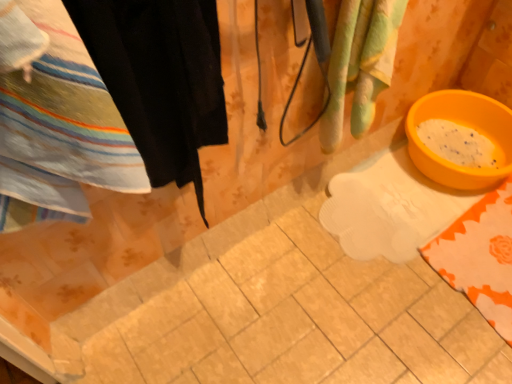
Looking at this image, what is the approximate width of green striped towel at upper right?

11.17 centimeters.

In the scene shown: What is the approximate width of striped cotton towel at left?

7.85 inches.

The image size is (512, 384). In order to click on green striped towel at upper right in this screenshot , I will do `click(360, 65)`.

In the scene shown: Is orange plastic basin at lower right not inside black fabric at left?

Absolutely, orange plastic basin at lower right is external to black fabric at left.

Considering the sizes of objects orange plastic basin at lower right and black fabric at left in the image provided, who is taller, orange plastic basin at lower right or black fabric at left?

Standing taller between the two is black fabric at left.

Considering the sizes of objects orange plastic basin at lower right and black fabric at left in the image provided, who is wider, orange plastic basin at lower right or black fabric at left?

With larger width is orange plastic basin at lower right.

The height and width of the screenshot is (384, 512). Find the location of `clothing located on the left of orange plastic basin at lower right`. clothing located on the left of orange plastic basin at lower right is located at coordinates (160, 78).

Considering the relative sizes of green striped towel at upper right and striped cotton towel at left in the image provided, is green striped towel at upper right bigger than striped cotton towel at left?

Incorrect, green striped towel at upper right is not larger than striped cotton towel at left.

Is green striped towel at upper right taller or shorter than striped cotton towel at left?

Considering their sizes, green striped towel at upper right has more height than striped cotton towel at left.

Does green striped towel at upper right come in front of striped cotton towel at left?

No, it is behind striped cotton towel at left.

From a real-world perspective, is green striped towel at upper right positioned over striped cotton towel at left based on gravity?

No, from a real-world perspective, green striped towel at upper right is not above striped cotton towel at left.

Relative to green striped towel at upper right, is black fabric at left in front or behind?

black fabric at left is in front of green striped towel at upper right.

From the image's perspective, would you say black fabric at left is shown under green striped towel at upper right?

Correct, black fabric at left appears lower than green striped towel at upper right in the image.

Does black fabric at left have a greater height compared to green striped towel at upper right?

Yes, black fabric at left is taller than green striped towel at upper right.

At what (x,y) coordinates should I click in order to perform the action: click on clothing above the orange plastic basin at lower right (from a real-world perspective). Please return your answer as a coordinate pair (x, y). Image resolution: width=512 pixels, height=384 pixels. Looking at the image, I should click on (160, 78).

Is black fabric at left not inside orange plastic basin at lower right?

black fabric at left is positioned outside orange plastic basin at lower right.

Between point (164, 83) and point (419, 166), which one is positioned in front?

The point (164, 83) is in front.

Considering the sizes of black fabric at left and orange plastic basin at lower right in the image, is black fabric at left wider or thinner than orange plastic basin at lower right?

Considering their sizes, black fabric at left looks slimmer than orange plastic basin at lower right.

From the image's perspective, between striped cotton towel at left and orange plastic basin at lower right, which one is located above?

From the image's view, orange plastic basin at lower right is above.

From a real-world perspective, who is located lower, striped cotton towel at left or orange plastic basin at lower right?

In real-world perspective, orange plastic basin at lower right is lower.

Which of these two, striped cotton towel at left or orange plastic basin at lower right, is thinner?

striped cotton towel at left.

Would you consider striped cotton towel at left to be distant from orange plastic basin at lower right?

striped cotton towel at left is far away from orange plastic basin at lower right.

Considering the relative positions of black fabric at left and striped cotton towel at left in the image provided, is black fabric at left to the left or to the right of striped cotton towel at left?

In the image, black fabric at left appears on the right side of striped cotton towel at left.

Considering their positions, is black fabric at left located in front of or behind striped cotton towel at left?

black fabric at left is positioned farther from the viewer than striped cotton towel at left.

Is black fabric at left facing towards striped cotton towel at left?

No, black fabric at left is not turned towards striped cotton towel at left.

From the image's perspective, between black fabric at left and striped cotton towel at left, who is located below?

striped cotton towel at left appears lower in the image.

Is green striped towel at upper right facing towards orange plastic basin at lower right?

No, green striped towel at upper right is not aimed at orange plastic basin at lower right.

Is green striped towel at upper right taller than orange plastic basin at lower right?

Correct, green striped towel at upper right is much taller as orange plastic basin at lower right.

Which object is further away from the camera, green striped towel at upper right or orange plastic basin at lower right?

orange plastic basin at lower right is further away from the camera.

Consider the image. Is green striped towel at upper right in contact with orange plastic basin at lower right?

No, green striped towel at upper right is not next to orange plastic basin at lower right.

Find the location of `clothing above the orange plastic basin at lower right (from a real-world perspective)`. clothing above the orange plastic basin at lower right (from a real-world perspective) is located at coordinates (160, 78).

Identify the location of beach towel that is behind the striped cotton towel at left. pos(360,65).

Based on their spatial positions, is orange plastic basin at lower right or striped cotton towel at left closer to black fabric at left?

Among the two, striped cotton towel at left is located nearer to black fabric at left.

Which object lies further to the anchor point black fabric at left, orange plastic basin at lower right or green striped towel at upper right?

Among the two, orange plastic basin at lower right is located further to black fabric at left.

Considering their positions, is orange plastic basin at lower right positioned closer to striped cotton towel at left than black fabric at left?

black fabric at left.

Consider the image. Estimate the real-world distances between objects in this image. Which object is further from black fabric at left, striped cotton towel at left or green striped towel at upper right?

green striped towel at upper right is further to black fabric at left.

Estimate the real-world distances between objects in this image. Which object is closer to striped cotton towel at left, orange plastic basin at lower right or green striped towel at upper right?

Among the two, green striped towel at upper right is located nearer to striped cotton towel at left.

Estimate the real-world distances between objects in this image. Which object is closer to green striped towel at upper right, black fabric at left or striped cotton towel at left?

black fabric at left is positioned closer to the anchor green striped towel at upper right.

Estimate the real-world distances between objects in this image. Which object is closer to striped cotton towel at left, green striped towel at upper right or black fabric at left?

Among the two, black fabric at left is located nearer to striped cotton towel at left.

Consider the image. From the image, which object appears to be nearer to orange plastic basin at lower right, black fabric at left or green striped towel at upper right?

green striped towel at upper right is closer to orange plastic basin at lower right.

Find the location of `clothing between striped cotton towel at left and green striped towel at upper right from left to right`. clothing between striped cotton towel at left and green striped towel at upper right from left to right is located at coordinates (160, 78).

Locate an element on the screen. The width and height of the screenshot is (512, 384). beach towel between striped cotton towel at left and orange plastic basin at lower right in the horizontal direction is located at coordinates (360, 65).

Identify the location of beach towel between black fabric at left and orange plastic basin at lower right in the horizontal direction. (360, 65).

Locate an element on the screen. This screenshot has width=512, height=384. clothing between striped cotton towel at left and orange plastic basin at lower right from left to right is located at coordinates (160, 78).